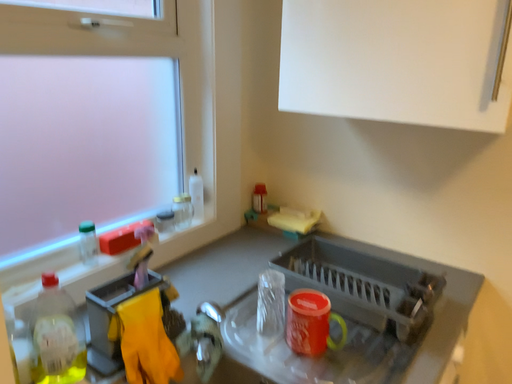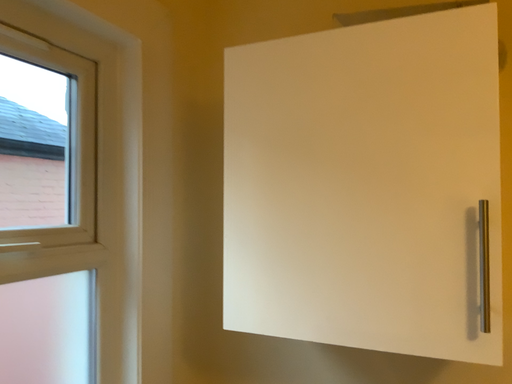
Question: Which way did the camera rotate in the video?

Choices:
 (A) rotated left
 (B) rotated right

Answer: (B)